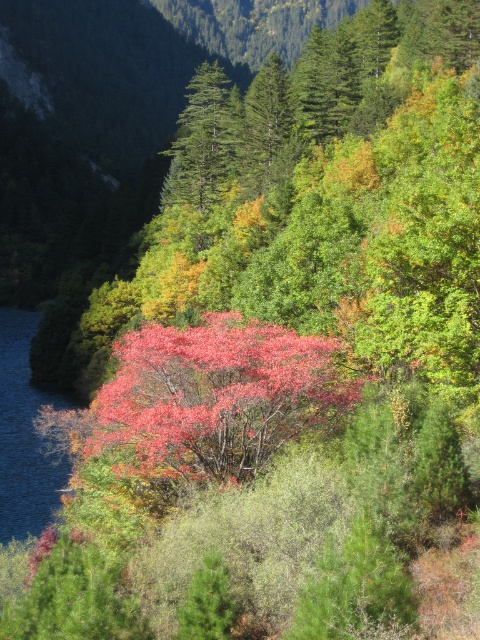
Does blue liquid water at left appear over green matte tree at center?

No.

Does point (35, 401) lie behind point (216, 84)?

No, (35, 401) is in front of (216, 84).

Image resolution: width=480 pixels, height=640 pixels. I want to click on blue liquid water at left, so [24, 433].